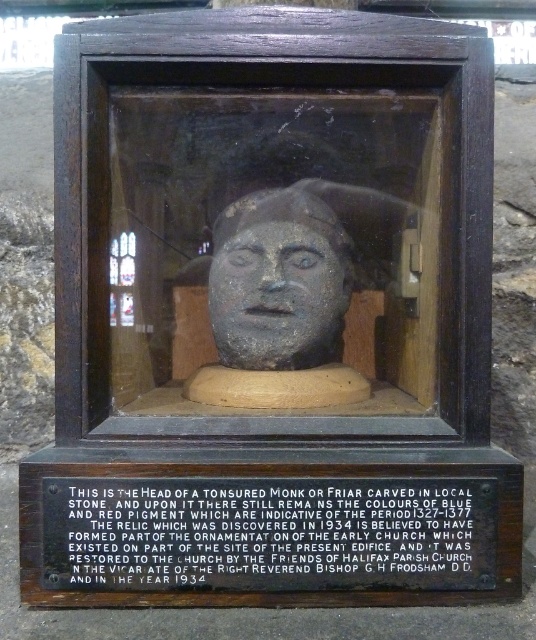
Question: Does black wood plaque at lower center appear over matte stone head at center?

Choices:
 (A) yes
 (B) no

Answer: (B)

Question: Does black wood plaque at lower center have a larger size compared to matte stone head at center?

Choices:
 (A) no
 (B) yes

Answer: (A)

Question: Which object appears farthest from the camera in this image?

Choices:
 (A) matte stone head at center
 (B) black wood plaque at lower center

Answer: (A)

Question: Is black wood plaque at lower center above matte stone head at center?

Choices:
 (A) no
 (B) yes

Answer: (A)

Question: Among these points, which one is farthest from the camera?

Choices:
 (A) (308, 246)
 (B) (227, 572)

Answer: (A)

Question: Which point appears farthest from the camera in this image?

Choices:
 (A) (201, 556)
 (B) (311, 364)

Answer: (B)